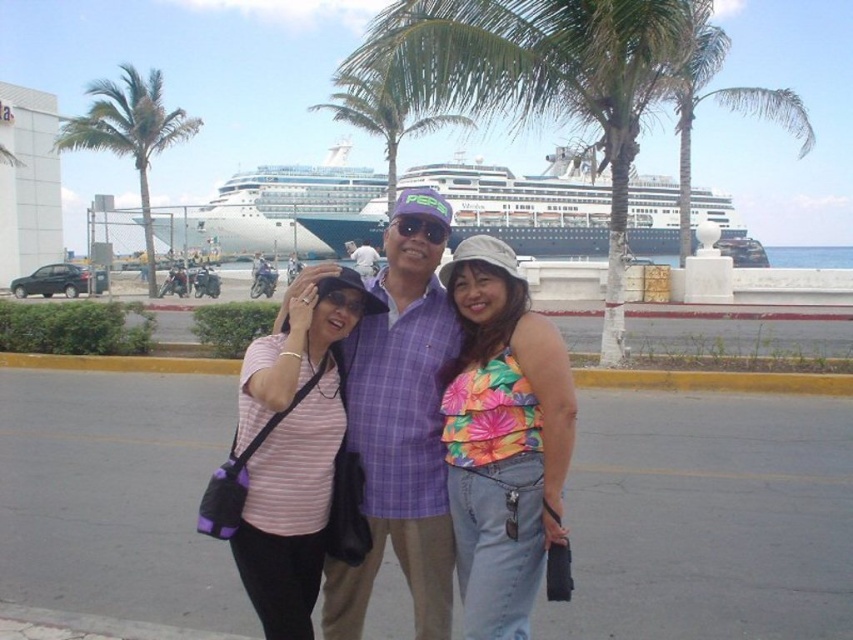
You are a photographer trying to capture a group photo of the two people in the image. The floral fabric tank top at center and the pink striped shirt at center. You want to ensure both subjects are fully visible in the photo. Given their heights, which subject should you position closer to the camera to avoid one blocking the other?

The floral fabric tank top at center is shorter than the pink striped shirt at center. To ensure both are fully visible, position the floral fabric tank top at center closer to the camera so their height difference doesn

From the picture: You are a photographer trying to capture a group photo of the two people in the image. The subjects are wearing a floral fabric tank top at center and a pink striped shirt at center. Based on their positions, which subject should you ask to move slightly to the left to create more space between them?

The floral fabric tank top at center is to the right of the pink striped shirt at center, so you should ask the person wearing the floral fabric tank top at center to move slightly to the left to create more space between them.

You are a photographer trying to capture a photo of the striped cotton shirt at center and the green leafy palm tree at upper left. Which object is positioned to the right side in the image?

The striped cotton shirt at center is to the right of the green leafy palm tree at upper left, so the striped cotton shirt at center is positioned to the right side in the image.